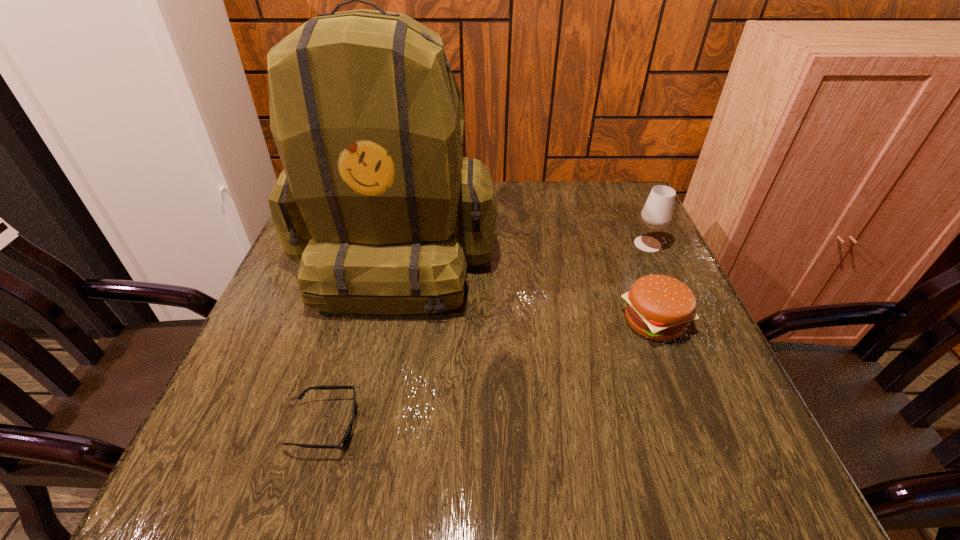
Find the location of a particular element. object located at the near edge is located at coordinates (345, 439).

Where is `backpack that is at the left edge`? This screenshot has height=540, width=960. backpack that is at the left edge is located at coordinates (376, 202).

What are the coordinates of `sunglasses located in the left edge section of the desktop` in the screenshot? It's located at (345, 439).

Identify the location of glass that is at the right edge. This screenshot has width=960, height=540. (657, 213).

Identify the location of hamburger positioned at the right edge. The image size is (960, 540). (659, 307).

This screenshot has width=960, height=540. I want to click on object present at the far left corner, so click(x=376, y=202).

Locate an element on the screen. The height and width of the screenshot is (540, 960). object at the near left corner is located at coordinates (345, 439).

You are a GUI agent. You are given a task and a screenshot of the screen. Output one action in this format:
    pyautogui.click(x=<x>, y=<y>)
    Task: Click on the free space at the far edge of the desktop
    The image size is (960, 540).
    Given the screenshot: What is the action you would take?
    pyautogui.click(x=502, y=195)

The image size is (960, 540). I want to click on free location at the near edge, so click(x=479, y=451).

Locate an element on the screen. The width and height of the screenshot is (960, 540). blank space at the left edge of the desktop is located at coordinates (256, 386).